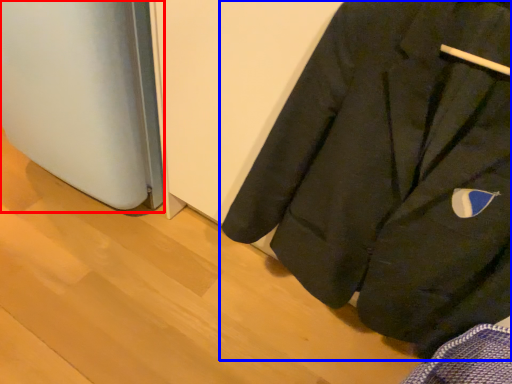
Question: Which object appears farthest to the camera in this image, appliance (highlighted by a red box) or coat (highlighted by a blue box)?

Choices:
 (A) appliance
 (B) coat

Answer: (A)